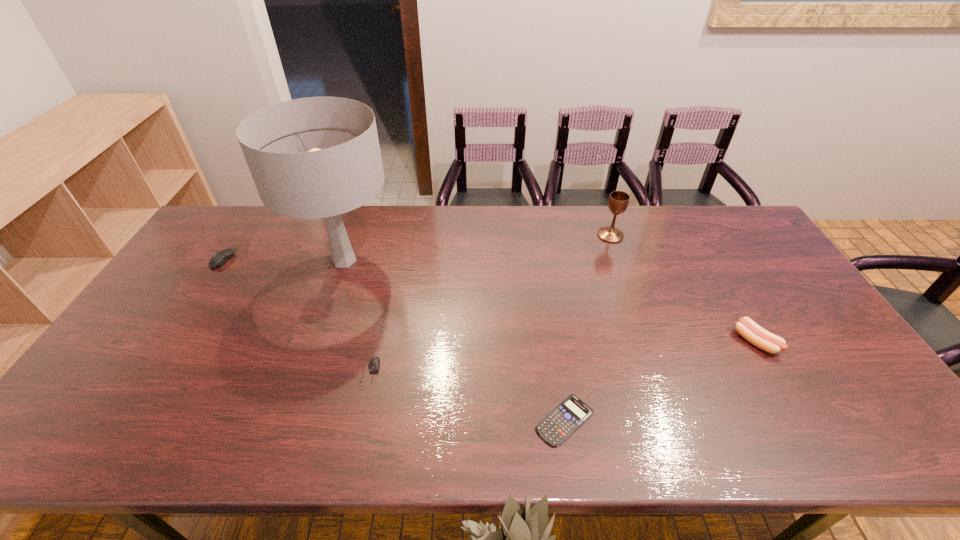
I want to click on the nearest object, so click(571, 413).

Identify the location of vacant space located on the front-facing side of the lampshade. Image resolution: width=960 pixels, height=540 pixels. (480, 260).

You are a GUI agent. You are given a task and a screenshot of the screen. Output one action in this format:
    pyautogui.click(x=<x>, y=<y>)
    Task: Click on the blank space located on the front of the fifth shortest object
    The height and width of the screenshot is (540, 960).
    Given the screenshot: What is the action you would take?
    pyautogui.click(x=622, y=268)

In order to click on blank area located on the right of the fourth shortest object in this screenshot , I will do `click(819, 341)`.

Identify the location of free space located on the back of the leftmost object. (236, 240).

The image size is (960, 540). Find the location of `free spot located on the left of the shorter mouse`. free spot located on the left of the shorter mouse is located at coordinates tap(315, 372).

At what (x,y) coordinates should I click in order to perform the action: click on vacant area located 0.190m on the right of the calculator. Please return your answer as a coordinate pair (x, y). The image size is (960, 540). Looking at the image, I should click on (677, 420).

The image size is (960, 540). Find the location of `lampshade situated at the far edge`. lampshade situated at the far edge is located at coordinates (318, 157).

The width and height of the screenshot is (960, 540). What are the coordinates of `chalice situated at the far edge` in the screenshot? It's located at (618, 202).

Where is `object at the near edge`? object at the near edge is located at coordinates (571, 413).